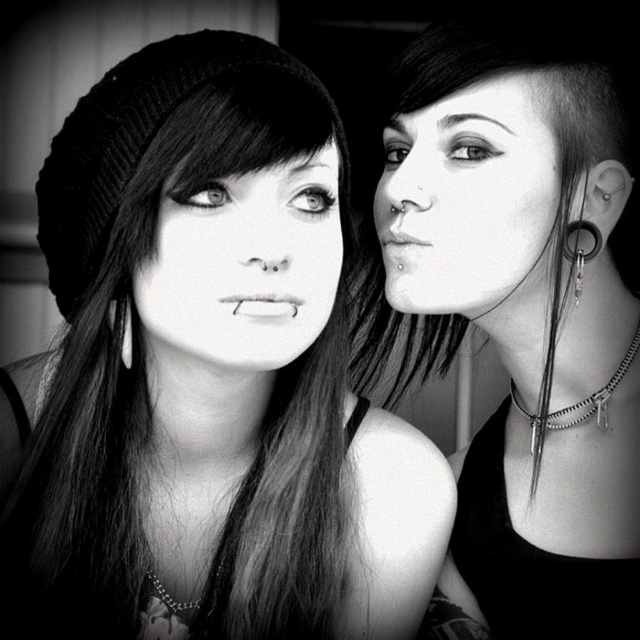
Image resolution: width=640 pixels, height=640 pixels. In order to click on silver metallic earring at left in this screenshot , I will do `click(125, 333)`.

Is silver metallic earring at left positioned behind silver metallic spike at right?

No.

Where is `silver metallic earring at left`? The width and height of the screenshot is (640, 640). silver metallic earring at left is located at coordinates (125, 333).

Between shiny silver earring at upper right and smooth skin face at center, which one is positioned higher?

smooth skin face at center

Does shiny silver earring at upper right appear under smooth skin face at center?

Indeed, shiny silver earring at upper right is positioned under smooth skin face at center.

Does point (540, 577) lie in front of point (156, 228)?

No, it is behind (156, 228).

Find the location of a particular element. This screenshot has height=640, width=640. shiny silver earring at upper right is located at coordinates (522, 320).

Find the location of `smooth skin face at center`. smooth skin face at center is located at coordinates (244, 266).

Measure the distance between point (276, 189) and camera.

They are 21.20 inches apart.

At what (x,y) coordinates should I click in order to perform the action: click on smooth skin face at center. Please return your answer as a coordinate pair (x, y). Looking at the image, I should click on (244, 266).

I want to click on smooth skin face at center, so click(x=244, y=266).